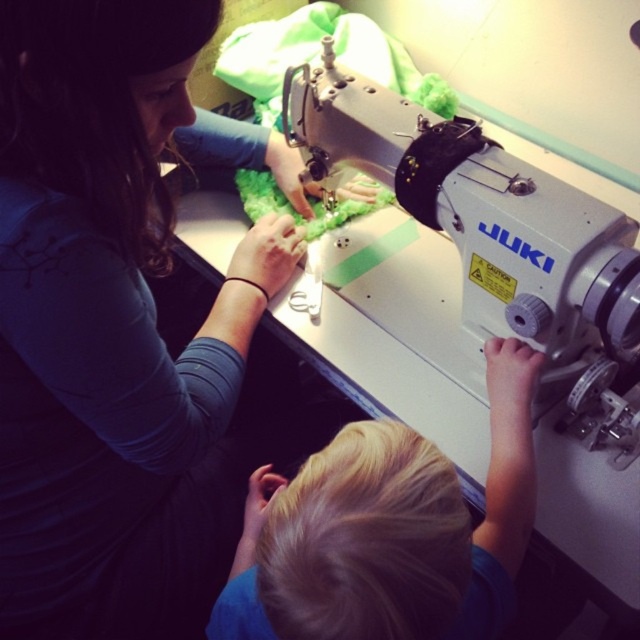
Question: Based on their relative distances, which object is nearer to the matte blue shirt at upper left?

Choices:
 (A) silver metallic sewing machine at center
 (B) blonde hair at lower center

Answer: (B)

Question: Can you confirm if matte blue shirt at upper left is positioned to the left of blonde hair at lower center?

Choices:
 (A) yes
 (B) no

Answer: (A)

Question: Where is silver metallic sewing machine at center located in relation to blonde hair at lower center in the image?

Choices:
 (A) above
 (B) below

Answer: (A)

Question: Which of the following is the farthest from the observer?

Choices:
 (A) (49, 56)
 (B) (534, 493)
 (C) (614, 429)

Answer: (C)

Question: Which of the following is the closest to the observer?

Choices:
 (A) matte blue shirt at upper left
 (B) silver metallic sewing machine at center
 (C) blonde hair at lower center

Answer: (A)

Question: Can you confirm if matte blue shirt at upper left is positioned below silver metallic sewing machine at center?

Choices:
 (A) no
 (B) yes

Answer: (B)